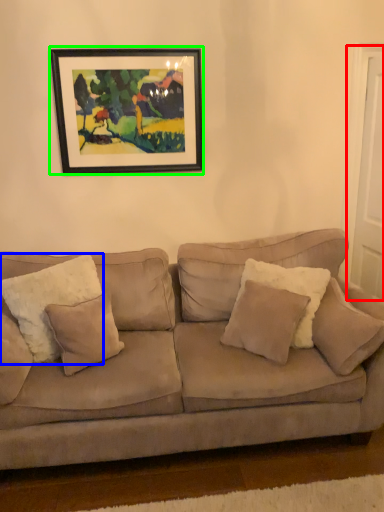
Question: Estimate the real-world distances between objects in this image. Which object is farther from door (highlighted by a red box), pillow (highlighted by a blue box) or picture frame (highlighted by a green box)?

Choices:
 (A) pillow
 (B) picture frame

Answer: (A)